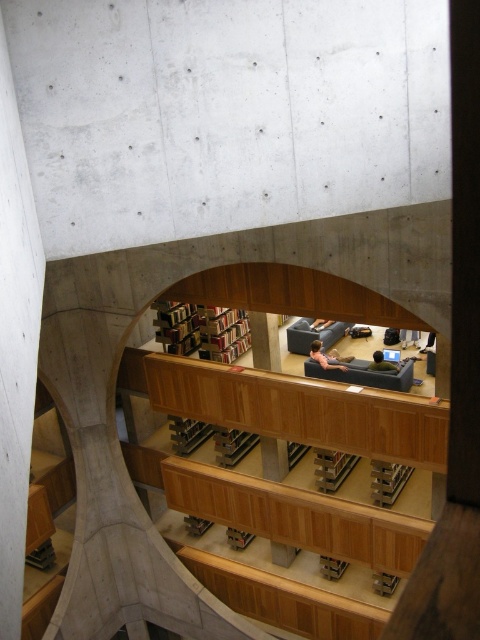
Question: Among these objects, which one is nearest to the camera?

Choices:
 (A) white concrete pillar at center
 (B) wooden stairs at center

Answer: (A)

Question: Can you confirm if wooden stairs at center is smaller than wooden bookshelf at center?

Choices:
 (A) no
 (B) yes

Answer: (B)

Question: Among these objects, which one is farthest from the camera?

Choices:
 (A) wooden stairs at center
 (B) white concrete pillar at center

Answer: (A)

Question: Which point is farther from the camera taking this photo?

Choices:
 (A) (183, 340)
 (B) (8, 456)

Answer: (A)

Question: Is the position of wooden stairs at center more distant than that of white concrete pillar at center?

Choices:
 (A) yes
 (B) no

Answer: (A)

Question: Can you confirm if wooden stairs at center is positioned above white concrete pillar at center?

Choices:
 (A) no
 (B) yes

Answer: (A)